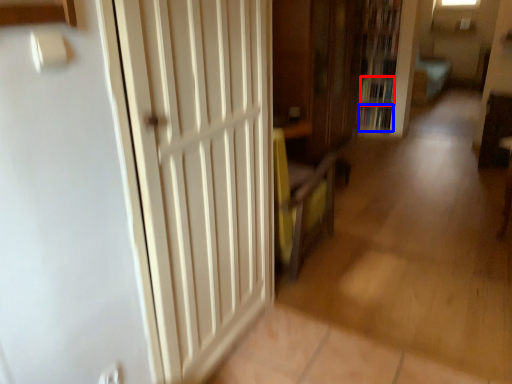
Question: Which of the following is the closest to the observer, book (highlighted by a red box) or book (highlighted by a blue box)?

Choices:
 (A) book
 (B) book

Answer: (A)